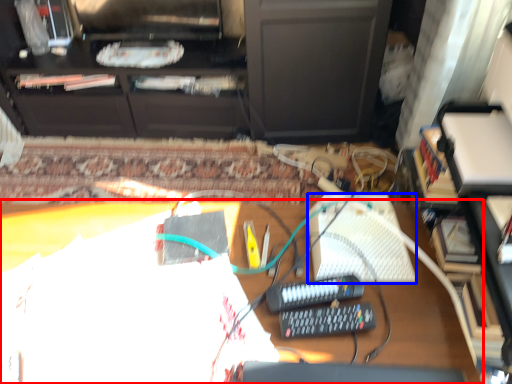
Question: Among these objects, which one is farthest to the camera, desk (highlighted by a red box) or keyboard (highlighted by a blue box)?

Choices:
 (A) desk
 (B) keyboard

Answer: (B)